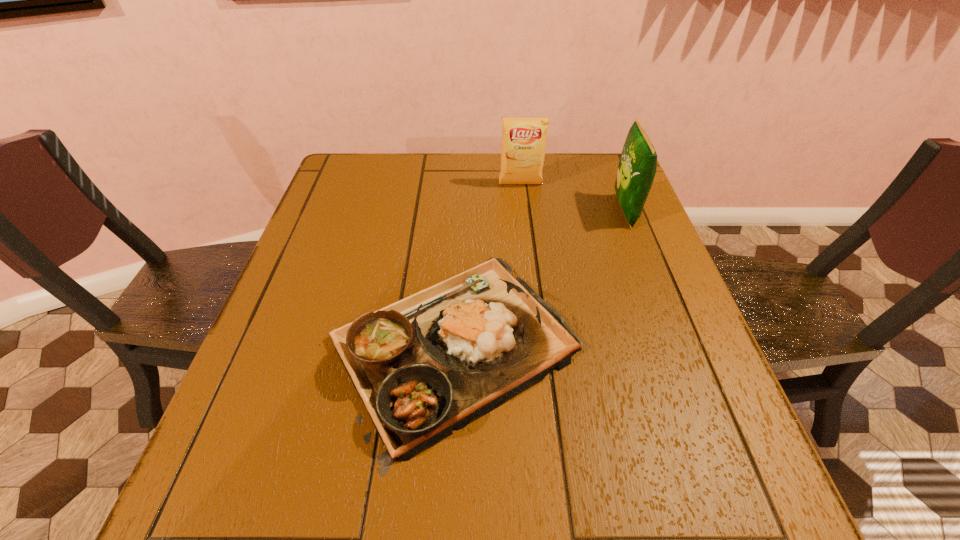
Where is `free space located 0.210m on the right of the nearest object`? The width and height of the screenshot is (960, 540). free space located 0.210m on the right of the nearest object is located at coordinates (689, 346).

I want to click on object located in the near edge section of the desktop, so click(426, 365).

You are a GUI agent. You are given a task and a screenshot of the screen. Output one action in this format:
    pyautogui.click(x=<x>, y=<y>)
    Task: Click on the object that is positioned at the left edge
    Image resolution: width=960 pixels, height=540 pixels.
    Given the screenshot: What is the action you would take?
    pyautogui.click(x=426, y=365)

Find the location of a particular element. object that is at the right edge is located at coordinates (637, 167).

Where is `object that is at the near left corner`? This screenshot has width=960, height=540. object that is at the near left corner is located at coordinates (426, 365).

I want to click on object at the far right corner, so [637, 167].

The height and width of the screenshot is (540, 960). What are the coordinates of `free space at the far edge of the desktop` in the screenshot? It's located at (484, 163).

Identify the location of free space at the near edge of the desktop. The width and height of the screenshot is (960, 540). (498, 532).

I want to click on blank area at the left edge, so click(310, 385).

The height and width of the screenshot is (540, 960). Identify the location of free space at the right edge. (617, 321).